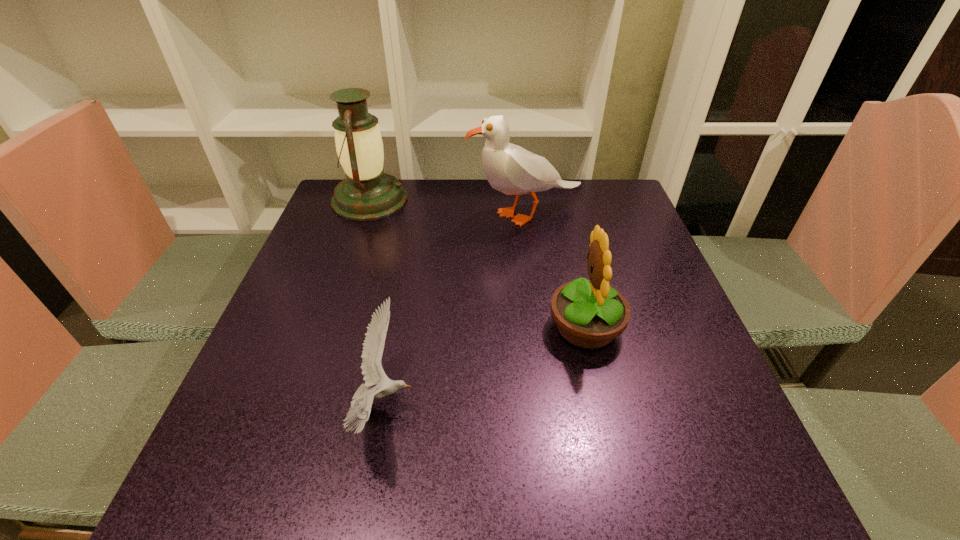
The width and height of the screenshot is (960, 540). In order to click on lantern in this screenshot , I will do `click(367, 193)`.

At what (x,y) coordinates should I click in order to perform the action: click on the farther gull. Please return your answer as a coordinate pair (x, y). The height and width of the screenshot is (540, 960). Looking at the image, I should click on (509, 168).

Identify the location of the taller gull. Image resolution: width=960 pixels, height=540 pixels. (509, 168).

You are a GUI agent. You are given a task and a screenshot of the screen. Output one action in this format:
    pyautogui.click(x=<x>, y=<y>)
    Task: Click on the sunflower
    
    Given the screenshot: What is the action you would take?
    pyautogui.click(x=589, y=314)

Where is `the shorter gull`? the shorter gull is located at coordinates (373, 346).

Where is `the nearer gull`? Image resolution: width=960 pixels, height=540 pixels. the nearer gull is located at coordinates (373, 346).

The width and height of the screenshot is (960, 540). In order to click on vacant region located with the light compartment facing forward on the lantern in this screenshot , I will do (495, 199).

The width and height of the screenshot is (960, 540). Identify the location of vacant region located at the beak of the taller gull. (358, 214).

The image size is (960, 540). I want to click on free space located at the beak of the taller gull, so click(445, 214).

Identify the location of free space located 0.080m at the beak of the taller gull. (439, 214).